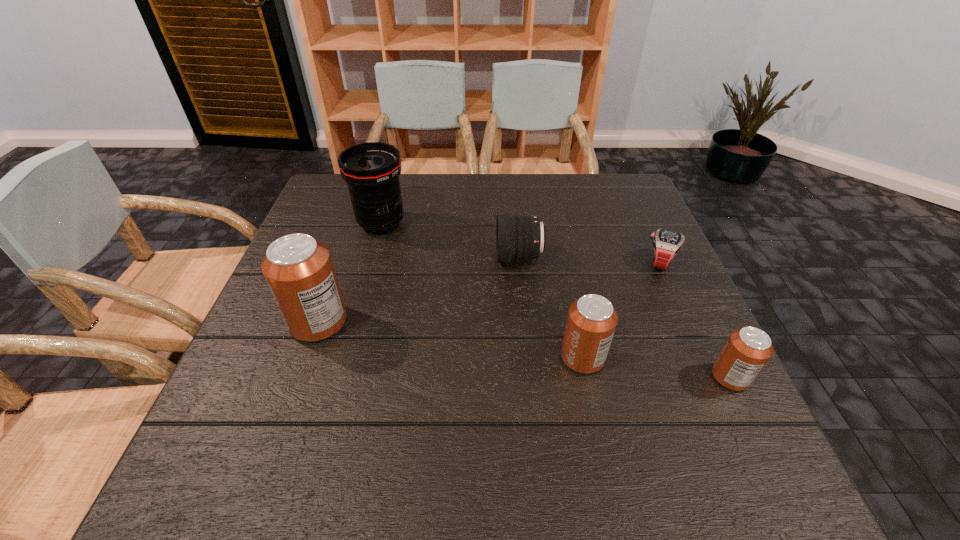
Identify which object is the closest to the second can from left to right. Please provide its 2D coordinates. Your answer should be formatted as a tuple, i.e. [(x, y)], where the tuple contains the x and y coordinates of a point satisfying the conditions above.

[(747, 350)]

Locate which can ranks third in proximity to the shortest object. Please provide its 2D coordinates. Your answer should be formatted as a tuple, i.e. [(x, y)], where the tuple contains the x and y coordinates of a point satisfying the conditions above.

[(298, 269)]

Locate an element on the screen. The height and width of the screenshot is (540, 960). can object that ranks as the second closest to the right telephoto lens is located at coordinates (298, 269).

Where is `free spot that satisfies the following two spatial constraints: 1. on the front side of the watch; 2. on the left side of the taller telephoto lens`? The width and height of the screenshot is (960, 540). free spot that satisfies the following two spatial constraints: 1. on the front side of the watch; 2. on the left side of the taller telephoto lens is located at coordinates (371, 262).

You are a GUI agent. You are given a task and a screenshot of the screen. Output one action in this format:
    pyautogui.click(x=<x>, y=<y>)
    Task: Click on the free space that satisfies the following two spatial constraints: 1. at the front element of the rightmost can; 2. on the right side of the third object from left to right
    
    Given the screenshot: What is the action you would take?
    pyautogui.click(x=531, y=377)

What are the coordinates of `vacant area in the image that satisfies the following two spatial constraints: 1. at the front element of the shorter telephoto lens; 2. on the right side of the shortest object` in the screenshot? It's located at (519, 262).

Identify the location of free region that satisfies the following two spatial constraints: 1. on the front side of the tallest can; 2. on the right side of the rightmost can. (300, 377).

The width and height of the screenshot is (960, 540). Find the location of `vacant area that satisfies the following two spatial constraints: 1. on the front side of the third tallest object; 2. on the right side of the tallest can`. vacant area that satisfies the following two spatial constraints: 1. on the front side of the third tallest object; 2. on the right side of the tallest can is located at coordinates (306, 357).

Where is `vacant space that satisfies the following two spatial constraints: 1. at the front element of the shorter telephoto lens; 2. on the right side of the rightmost can`? vacant space that satisfies the following two spatial constraints: 1. at the front element of the shorter telephoto lens; 2. on the right side of the rightmost can is located at coordinates (531, 377).

The image size is (960, 540). Identify the location of vacant space that satisfies the following two spatial constraints: 1. at the front element of the shorter telephoto lens; 2. on the right side of the rightmost can. 531,377.